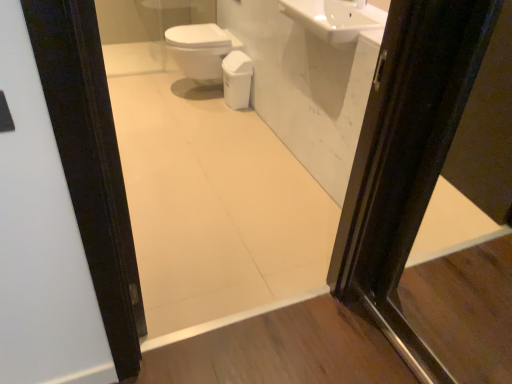
Question: Can you confirm if white glossy bidet at center is positioned to the right of white glossy mirror at upper center?

Choices:
 (A) no
 (B) yes

Answer: (A)

Question: From a real-world perspective, is white glossy bidet at center under white glossy mirror at upper center?

Choices:
 (A) yes
 (B) no

Answer: (A)

Question: Is white glossy bidet at center positioned behind white glossy mirror at upper center?

Choices:
 (A) no
 (B) yes

Answer: (B)

Question: From the image's perspective, is white glossy bidet at center above white glossy mirror at upper center?

Choices:
 (A) yes
 (B) no

Answer: (A)

Question: Can you confirm if white glossy bidet at center is wider than white glossy mirror at upper center?

Choices:
 (A) yes
 (B) no

Answer: (A)

Question: Considering the positions of white glossy mirror at upper center and white glossy sink at upper center in the image, is white glossy mirror at upper center wider or thinner than white glossy sink at upper center?

Choices:
 (A) wide
 (B) thin

Answer: (B)

Question: Considering the positions of point (238, 175) and point (344, 26), is point (238, 175) closer or farther from the camera than point (344, 26)?

Choices:
 (A) farther
 (B) closer

Answer: (A)

Question: From a real-world perspective, is white glossy mirror at upper center above or below white glossy sink at upper center?

Choices:
 (A) below
 (B) above

Answer: (A)

Question: From their relative heights in the image, would you say white glossy mirror at upper center is taller or shorter than white glossy sink at upper center?

Choices:
 (A) short
 (B) tall

Answer: (B)

Question: Is white glossy sink at upper center inside the boundaries of white glossy toilet bowl at center, or outside?

Choices:
 (A) outside
 (B) inside

Answer: (A)

Question: Does point (333, 13) appear closer or farther from the camera than point (228, 94)?

Choices:
 (A) farther
 (B) closer

Answer: (B)

Question: Considering their positions, is white glossy sink at upper center located in front of or behind white glossy toilet bowl at center?

Choices:
 (A) front
 (B) behind

Answer: (A)

Question: Looking at the image, does white glossy sink at upper center seem bigger or smaller compared to white glossy toilet bowl at center?

Choices:
 (A) big
 (B) small

Answer: (A)

Question: In the image, is white glossy sink at upper center positioned in front of or behind white glossy bidet at center?

Choices:
 (A) behind
 (B) front

Answer: (B)

Question: Considering the relative positions of white glossy sink at upper center and white glossy bidet at center in the image provided, is white glossy sink at upper center to the left or to the right of white glossy bidet at center?

Choices:
 (A) left
 (B) right

Answer: (B)